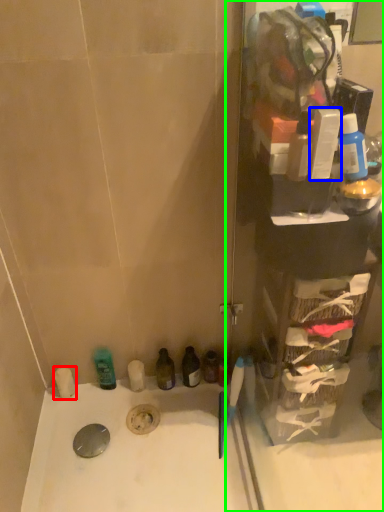
Question: Based on their relative distances, which object is farther from toiletry (highlighted by a red box)? Choose from toiletry (highlighted by a blue box) and glass door (highlighted by a green box).

Choices:
 (A) toiletry
 (B) glass door

Answer: (A)